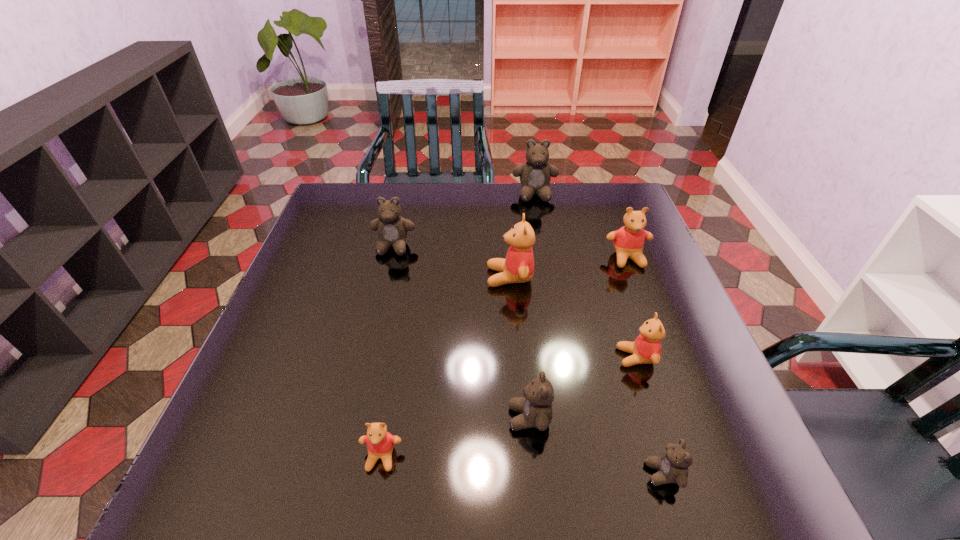
Identify the location of object that is at the near right corner. Image resolution: width=960 pixels, height=540 pixels. (672, 467).

At what (x,y) coordinates should I click in order to perform the action: click on free space at the far edge. Please return your answer as a coordinate pair (x, y). Looking at the image, I should click on (462, 220).

In the image, there is a desktop. At what (x,y) coordinates should I click in order to perform the action: click on vacant space at the near edge. Please return your answer as a coordinate pair (x, y). Looking at the image, I should click on (555, 488).

Identify the location of free location at the left edge of the desktop. (300, 374).

I want to click on vacant space at the right edge of the desktop, so click(x=698, y=413).

Where is `vacant area that lies between the rightmost brown teddy bear and the second nearest brown teddy bear`? This screenshot has width=960, height=540. vacant area that lies between the rightmost brown teddy bear and the second nearest brown teddy bear is located at coordinates (596, 446).

The image size is (960, 540). Identify the location of unoccupied area between the fifth farthest teddy bear and the biggest brown teddy bear. coord(586,276).

Identify the location of free space between the second smallest brown teddy bear and the second nearest red teddy bear. (583, 388).

At what (x,y) coordinates should I click in order to perform the action: click on vacant area that lies between the third smallest red teddy bear and the smallest brown teddy bear. Please return your answer as a coordinate pair (x, y). This screenshot has width=960, height=540. Looking at the image, I should click on (645, 366).

At what (x,y) coordinates should I click in order to perform the action: click on vacant point located between the third farthest red teddy bear and the third smallest red teddy bear. Please return your answer as a coordinate pair (x, y). Looking at the image, I should click on (632, 308).